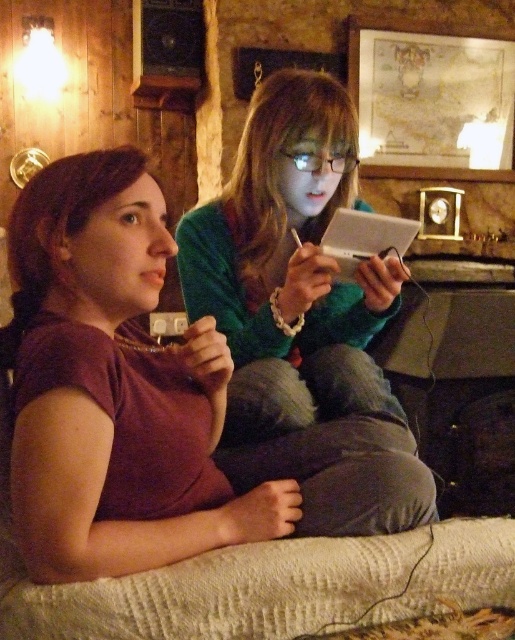
From the picture: Between matte purple shirt at center and green matte sweater at center, which one has less height?

matte purple shirt at center is shorter.

Is point (45, 182) less distant than point (221, 440)?

That is True.

The height and width of the screenshot is (640, 515). What do you see at coordinates (152, 403) in the screenshot?
I see `matte purple shirt at center` at bounding box center [152, 403].

This screenshot has width=515, height=640. Find the location of `matte purple shirt at center`. matte purple shirt at center is located at coordinates (152, 403).